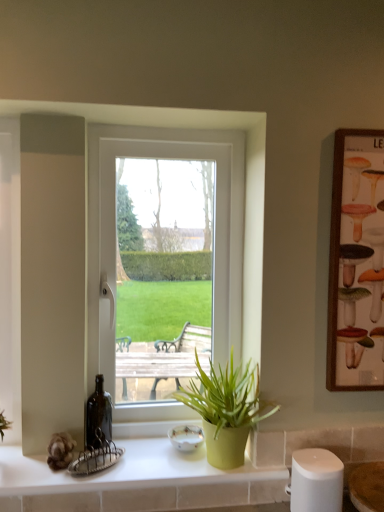
I want to click on free location to the left of green matte pot at lower center, so click(x=138, y=469).